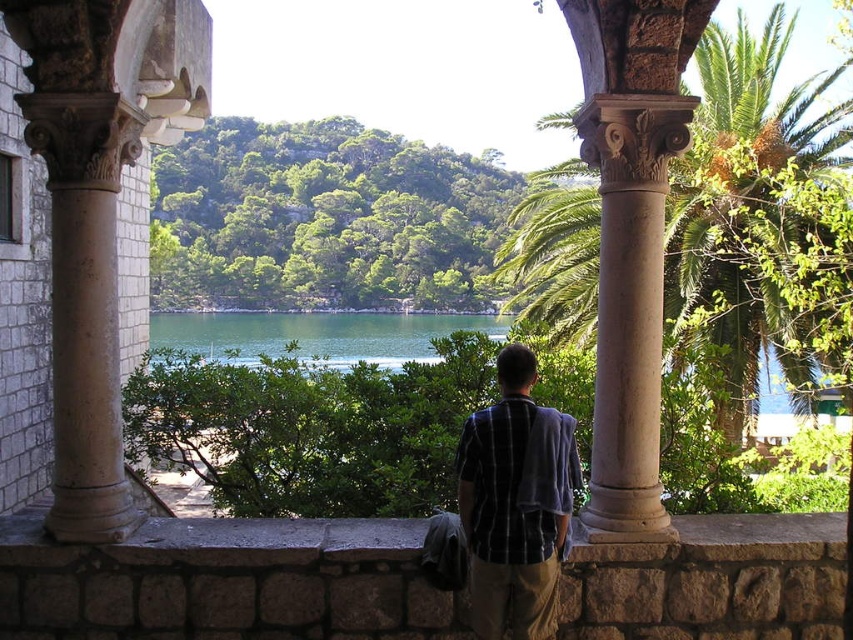
Question: Does stone ledge at center have a greater width compared to green leafy palm tree at center?

Choices:
 (A) no
 (B) yes

Answer: (A)

Question: Is green leafy palm tree at center closer to the viewer compared to green liquid water at center?

Choices:
 (A) no
 (B) yes

Answer: (B)

Question: Which point is farther to the camera?

Choices:
 (A) (471, 504)
 (B) (547, 276)

Answer: (B)

Question: Estimate the real-world distances between objects in this image. Which object is farther from the stone ledge at center?

Choices:
 (A) plaid shirt at center
 (B) green liquid water at center

Answer: (B)

Question: Which object is the closest to the smooth stone column at center?

Choices:
 (A) beige stone column at left
 (B) plaid shirt at center
 (C) stone ledge at center

Answer: (C)

Question: Can you confirm if beige stone column at left is positioned above green leafy palm tree at center?

Choices:
 (A) no
 (B) yes

Answer: (A)